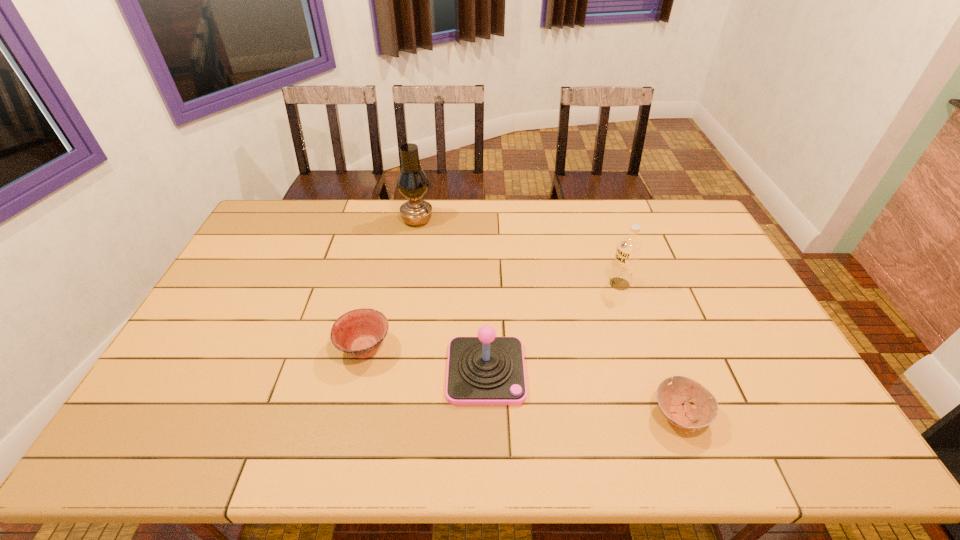
Locate an element on the screen. the tallest object is located at coordinates (412, 182).

Where is `the farthest object`? This screenshot has width=960, height=540. the farthest object is located at coordinates (412, 182).

What are the coordinates of `the second farthest object` in the screenshot? It's located at click(x=629, y=248).

You are a GUI agent. You are given a task and a screenshot of the screen. Output one action in this format:
    pyautogui.click(x=<x>, y=<y>)
    Task: Click on the second tallest object
    
    Given the screenshot: What is the action you would take?
    pyautogui.click(x=629, y=248)

The height and width of the screenshot is (540, 960). Find the location of `the third object from left to right`. the third object from left to right is located at coordinates (486, 370).

Locate an element on the screen. joystick is located at coordinates (486, 370).

Where is `the left bowl`? The width and height of the screenshot is (960, 540). the left bowl is located at coordinates (360, 332).

Locate an element on the screen. The image size is (960, 540). the farther bowl is located at coordinates (360, 332).

At what (x,y) coordinates should I click in order to perform the action: click on the shorter bowl. Please return your answer as a coordinate pair (x, y). The height and width of the screenshot is (540, 960). Looking at the image, I should click on (670, 398).

Identify the location of the right bowl. (670, 398).